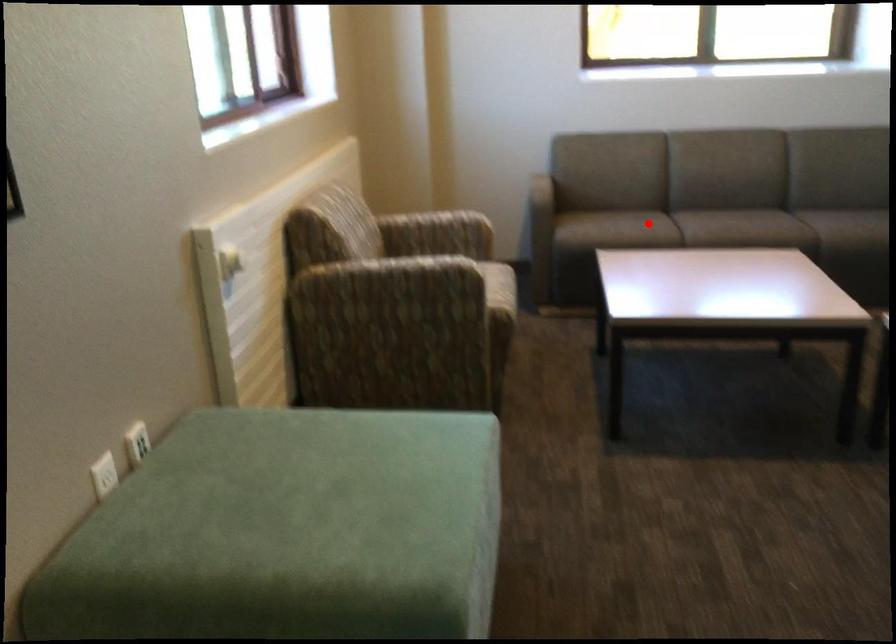
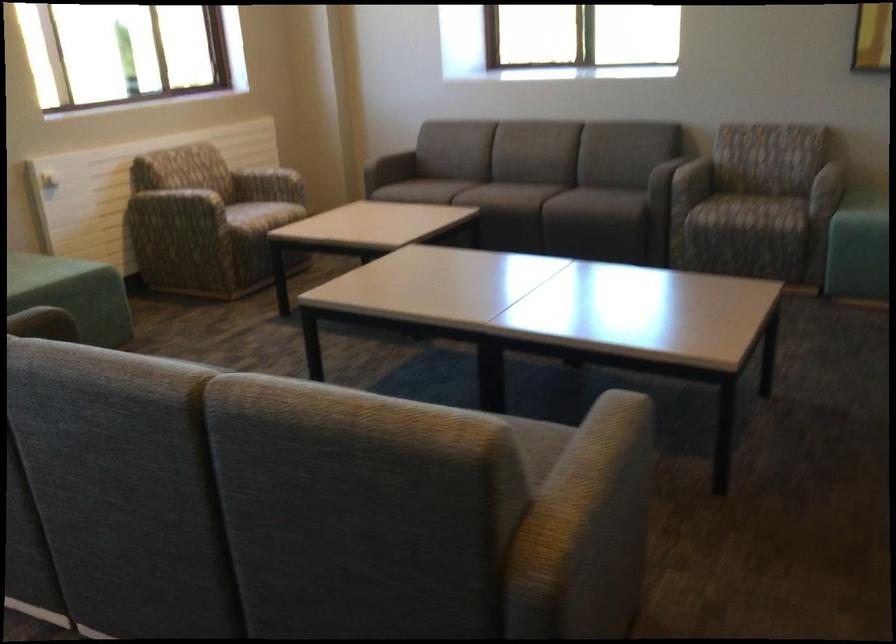
Question: I am providing you with two images of the same scene from different viewpoints. Image1 has a red point marked. In image2, the corresponding 3D location appears at what relative position? Reply with the corresponding letter.

Choices:
 (A) Closer
 (B) Farther

Answer: (B)